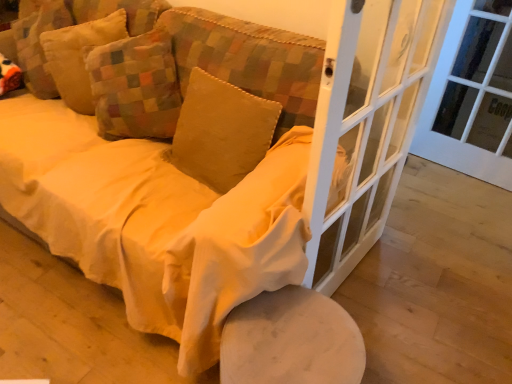
Question: Should I look upward or downward to see velvet yellow pillow at upper left, the 1th pillow from the left?

Choices:
 (A) down
 (B) up

Answer: (B)

Question: Is velvet yellow pillow at upper left, acting as the second pillow starting from the left, to the right of velvet yellow pillow at center, acting as the third pillow starting from the left, from the viewer's perspective?

Choices:
 (A) no
 (B) yes

Answer: (A)

Question: Is velvet yellow pillow at upper left, acting as the second pillow starting from the left, aimed at velvet yellow pillow at center, acting as the third pillow starting from the left?

Choices:
 (A) yes
 (B) no

Answer: (B)

Question: Would you say velvet yellow pillow at upper left, which ranks as the second pillow in right-to-left order, is outside velvet yellow pillow at center, acting as the third pillow starting from the left?

Choices:
 (A) no
 (B) yes

Answer: (B)

Question: Is velvet yellow pillow at upper left, which ranks as the second pillow in right-to-left order, next to velvet yellow pillow at center, which is the first pillow in right-to-left order?

Choices:
 (A) yes
 (B) no

Answer: (B)

Question: Considering the relative sizes of velvet yellow pillow at upper left, which ranks as the second pillow in right-to-left order, and velvet yellow pillow at center, acting as the third pillow starting from the left, in the image provided, is velvet yellow pillow at upper left, which ranks as the second pillow in right-to-left order, thinner than velvet yellow pillow at center, acting as the third pillow starting from the left,?

Choices:
 (A) no
 (B) yes

Answer: (A)

Question: From a real-world perspective, does velvet yellow pillow at upper left, acting as the second pillow starting from the left, sit lower than velvet yellow pillow at center, acting as the third pillow starting from the left?

Choices:
 (A) no
 (B) yes

Answer: (A)

Question: Is white glass door at right smaller than velvet yellow pillow at center, which is the first pillow in right-to-left order?

Choices:
 (A) yes
 (B) no

Answer: (B)

Question: Can you confirm if white glass door at right is positioned to the left of velvet yellow pillow at center, which is the first pillow in right-to-left order?

Choices:
 (A) yes
 (B) no

Answer: (B)

Question: From the image's perspective, does white glass door at right appear lower than velvet yellow pillow at center, acting as the third pillow starting from the left?

Choices:
 (A) no
 (B) yes

Answer: (A)

Question: Is white glass door at right positioned behind velvet yellow pillow at center, which is the first pillow in right-to-left order?

Choices:
 (A) no
 (B) yes

Answer: (B)

Question: Are white glass door at right and velvet yellow pillow at center, acting as the third pillow starting from the left, located far from each other?

Choices:
 (A) no
 (B) yes

Answer: (B)

Question: Is white glass door at right to the right of velvet yellow pillow at center, acting as the third pillow starting from the left, from the viewer's perspective?

Choices:
 (A) no
 (B) yes

Answer: (B)

Question: Are velvet yellow pillow at center, which is the first pillow in right-to-left order, and white glass screen door at center right located far from each other?

Choices:
 (A) no
 (B) yes

Answer: (A)